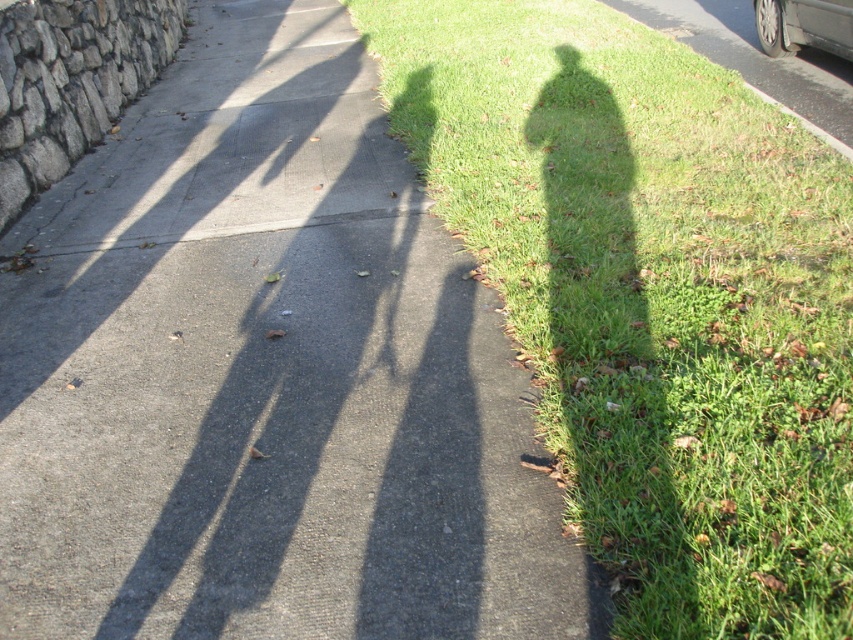
Question: Does green grass at upper right have a greater width compared to metallic gray car at upper right?

Choices:
 (A) yes
 (B) no

Answer: (A)

Question: Can you confirm if gray asphalt sidewalk at center is thinner than metallic gray car at upper right?

Choices:
 (A) yes
 (B) no

Answer: (A)

Question: Is gray asphalt sidewalk at center bigger than metallic gray car at upper right?

Choices:
 (A) yes
 (B) no

Answer: (B)

Question: Which object is closer to the camera taking this photo?

Choices:
 (A) green grass at upper right
 (B) gray asphalt sidewalk at center

Answer: (A)

Question: Estimate the real-world distances between objects in this image. Which object is closer to the metallic gray car at upper right?

Choices:
 (A) green grass at upper right
 (B) gray asphalt sidewalk at center

Answer: (A)

Question: Considering the real-world distances, which object is closest to the green grass at upper right?

Choices:
 (A) gray asphalt sidewalk at center
 (B) metallic gray car at upper right

Answer: (B)